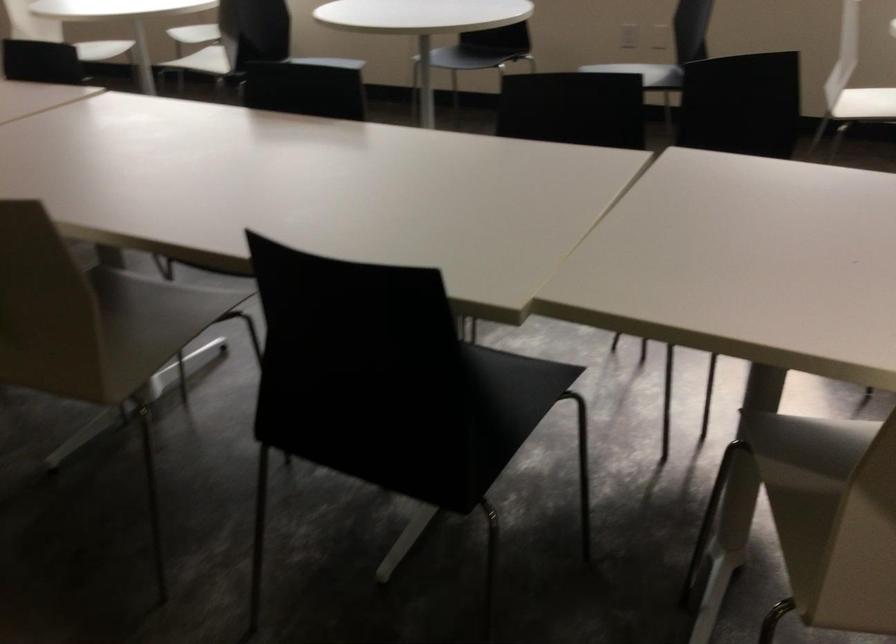
Identify the location of light colored chair surface. The image size is (896, 644). (831, 516).